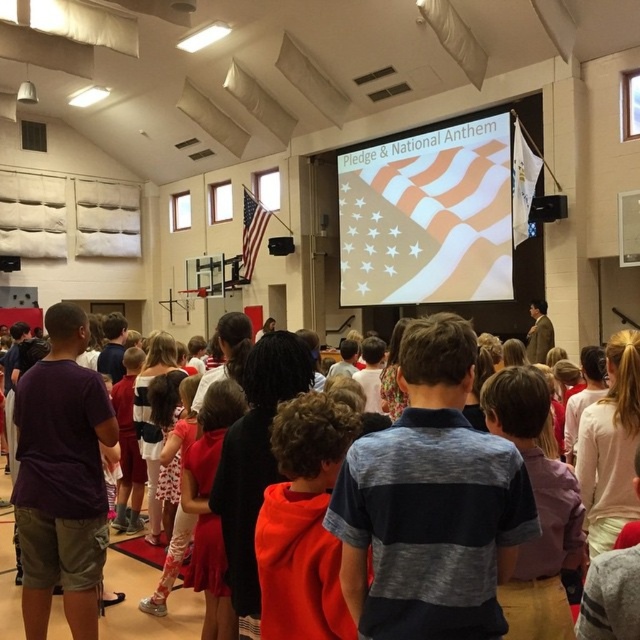
You are a photographer standing at the back of the gymnasium. You want to take a photo of the orange hoodie at center and the matte red dress at center so that both are clearly visible in the frame. Given that your camera has a minimum focus distance of 3 feet, will you be able to capture both subjects in the same photo without moving closer?

The orange hoodie at center and matte red dress at center are 3.83 feet apart from each other. Since the minimum focus distance is 3 feet, the 3.83 feet separation allows both subjects to be within the camera focus range. Therefore, you can capture both in the same photo without moving closer.

You are a photographer standing at the back of the gymnasium and want to take a photo of the orange hoodie at center and the matte red dress at center. Which of the two objects will appear smaller in the photo?

The orange hoodie at center will appear smaller in the photo because it has a lesser height compared to the matte red dress at center.